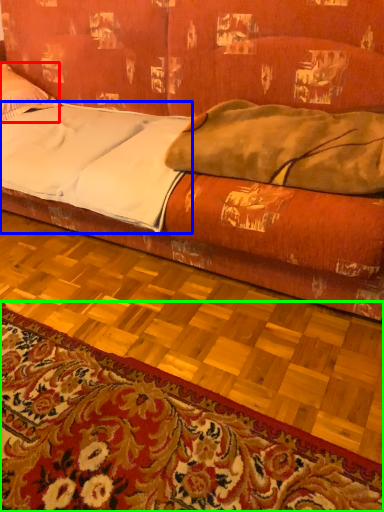
Question: Which object is the closest to the pillow (highlighted by a red box)? Choose among these: sheet (highlighted by a blue box) or mat (highlighted by a green box).

Choices:
 (A) sheet
 (B) mat

Answer: (A)